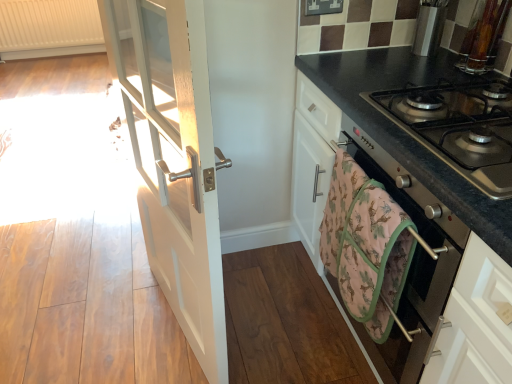
The width and height of the screenshot is (512, 384). Identify the location of vacant area located to the right-hand side of white wood door at left. (278, 320).